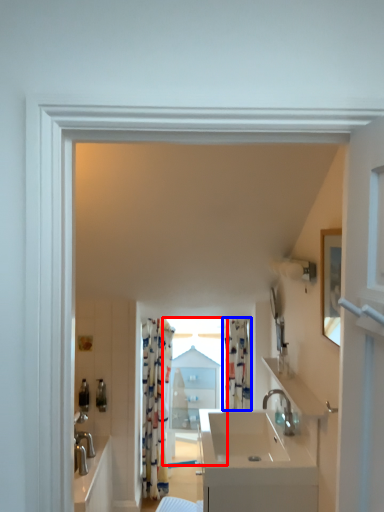
Question: Which point is closer to the camera, window (highlighted by a red box) or curtain (highlighted by a blue box)?

Choices:
 (A) window
 (B) curtain

Answer: (B)